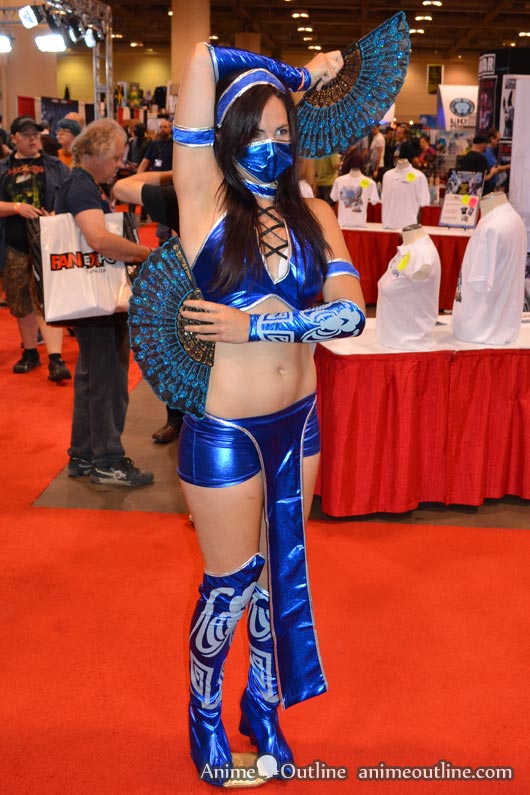
Find the location of `mannequin`. mannequin is located at coordinates (414, 276), (485, 257), (400, 188), (362, 188).